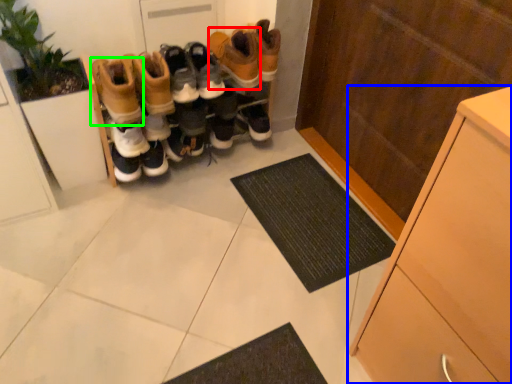
Question: Based on their relative distances, which object is farther from footwear (highlighted by a red box)? Choose from cabinetry (highlighted by a blue box) and footwear (highlighted by a green box).

Choices:
 (A) cabinetry
 (B) footwear

Answer: (A)